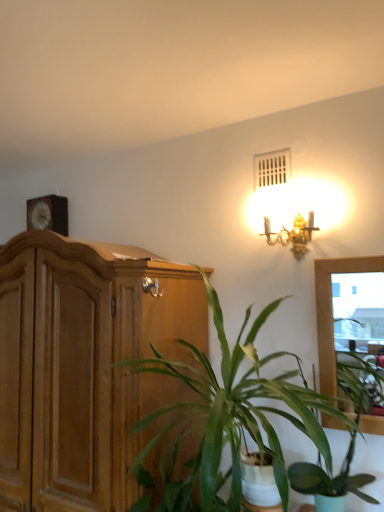
Question: Considering the relative sizes of wooden cabinet at left and green leafy plant at center, marked as the second houseplant in a left-to-right arrangement, in the image provided, is wooden cabinet at left bigger than green leafy plant at center, marked as the second houseplant in a left-to-right arrangement,?

Choices:
 (A) no
 (B) yes

Answer: (B)

Question: Is wooden cabinet at left looking in the opposite direction of green leafy plant at center, the 1th houseplant positioned from the right?

Choices:
 (A) yes
 (B) no

Answer: (B)

Question: From a real-world perspective, is wooden cabinet at left under green leafy plant at center, marked as the second houseplant in a left-to-right arrangement?

Choices:
 (A) yes
 (B) no

Answer: (B)

Question: Can you confirm if wooden cabinet at left is positioned to the right of green leafy plant at center, marked as the second houseplant in a left-to-right arrangement?

Choices:
 (A) yes
 (B) no

Answer: (B)

Question: Is wooden cabinet at left oriented towards green leafy plant at center, the 1th houseplant positioned from the right?

Choices:
 (A) no
 (B) yes

Answer: (A)

Question: Is gold metallic sconce at upper right inside the boundaries of green leafy plant at center, marked as the second houseplant in a left-to-right arrangement, or outside?

Choices:
 (A) inside
 (B) outside

Answer: (B)

Question: From the image's perspective, is gold metallic sconce at upper right located above or below green leafy plant at center, the 1th houseplant positioned from the right?

Choices:
 (A) below
 (B) above

Answer: (B)

Question: In terms of width, does gold metallic sconce at upper right look wider or thinner when compared to green leafy plant at center, marked as the second houseplant in a left-to-right arrangement?

Choices:
 (A) wide
 (B) thin

Answer: (B)

Question: Would you say gold metallic sconce at upper right is to the left or to the right of green leafy plant at center, marked as the second houseplant in a left-to-right arrangement, in the picture?

Choices:
 (A) left
 (B) right

Answer: (A)

Question: From a real-world perspective, relative to green leafy plant at center, the 1th houseplant when ordered from left to right, is gold metallic sconce at upper right vertically above or below?

Choices:
 (A) below
 (B) above

Answer: (B)

Question: Is gold metallic sconce at upper right spatially inside green leafy plant at center, marked as the second houseplant in a right-to-left arrangement, or outside of it?

Choices:
 (A) inside
 (B) outside

Answer: (B)

Question: Considering the relative positions of gold metallic sconce at upper right and green leafy plant at center, the 1th houseplant when ordered from left to right, in the image provided, is gold metallic sconce at upper right to the left or to the right of green leafy plant at center, the 1th houseplant when ordered from left to right,?

Choices:
 (A) left
 (B) right

Answer: (B)

Question: Based on their sizes in the image, would you say gold metallic sconce at upper right is bigger or smaller than green leafy plant at center, marked as the second houseplant in a right-to-left arrangement?

Choices:
 (A) big
 (B) small

Answer: (B)

Question: Considering the positions of gold metallic sconce at upper right and wooden clock at upper left in the image, is gold metallic sconce at upper right taller or shorter than wooden clock at upper left?

Choices:
 (A) tall
 (B) short

Answer: (B)

Question: In terms of width, does gold metallic sconce at upper right look wider or thinner when compared to wooden clock at upper left?

Choices:
 (A) wide
 (B) thin

Answer: (A)